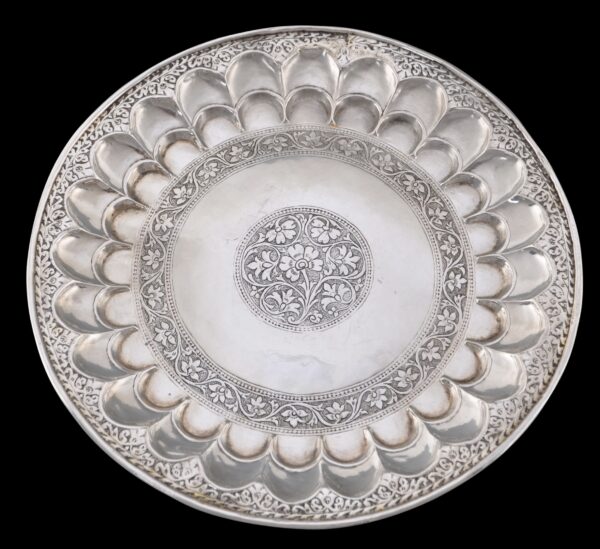
The height and width of the screenshot is (549, 600). Identify the location of top of plate rim. (295, 27).